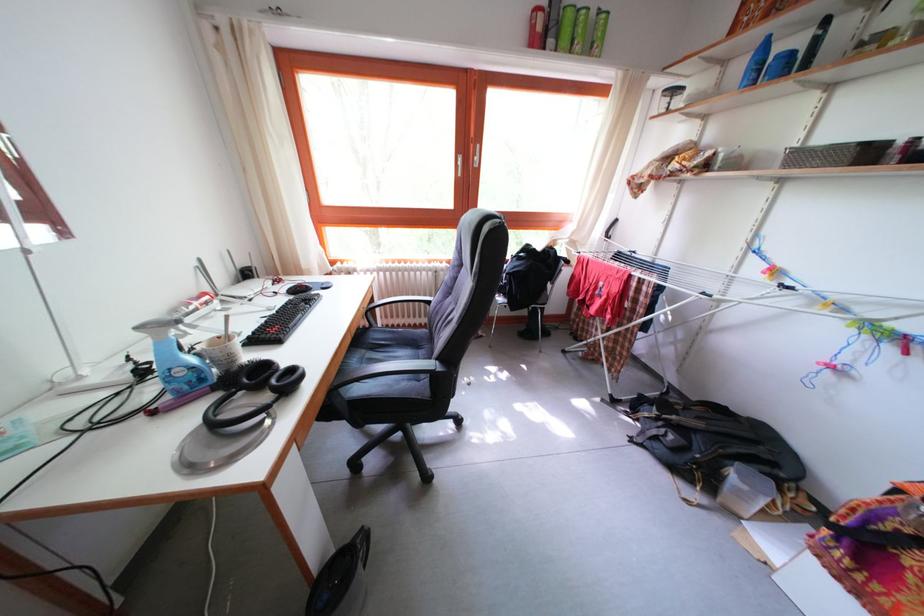
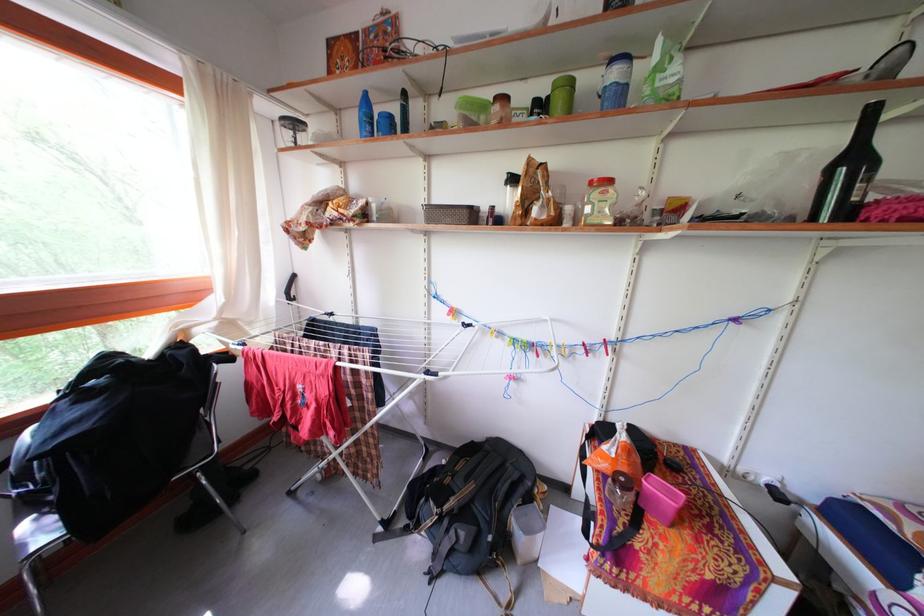
Question: The camera is either moving clockwise (left) or counter-clockwise (right) around the object. The first image is from the beginning of the video and the second image is from the end. Is the camera moving left or right when shooting the video?

Choices:
 (A) Left
 (B) Right

Answer: (A)